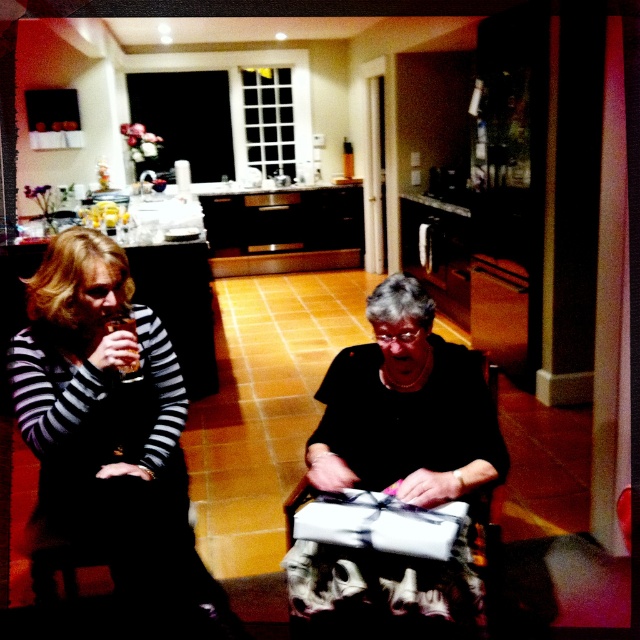
Can you confirm if striped fabric dress at left is smaller than black matte gift at center?

No, striped fabric dress at left is not smaller than black matte gift at center.

Is point (106, 326) positioned behind point (396, 273)?

No.

Who is more distant from viewer, (x=131, y=509) or (x=372, y=401)?

Positioned behind is point (x=372, y=401).

Locate an element on the screen. This screenshot has width=640, height=640. striped fabric dress at left is located at coordinates (113, 433).